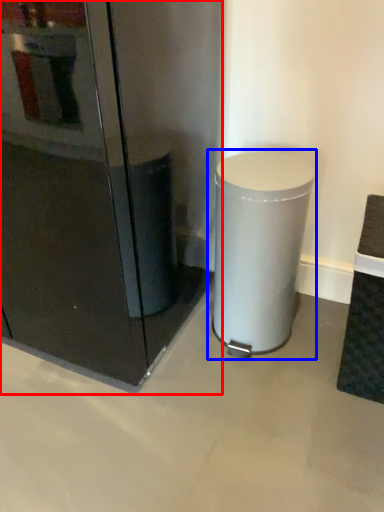
Question: Which object is closer to the camera taking this photo, fridge (highlighted by a red box) or waste container (highlighted by a blue box)?

Choices:
 (A) fridge
 (B) waste container

Answer: (A)